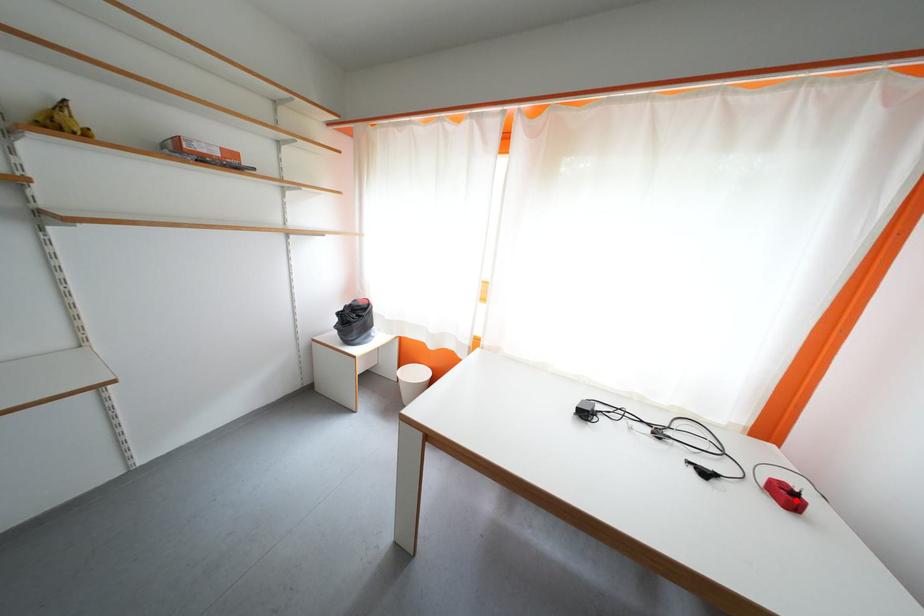
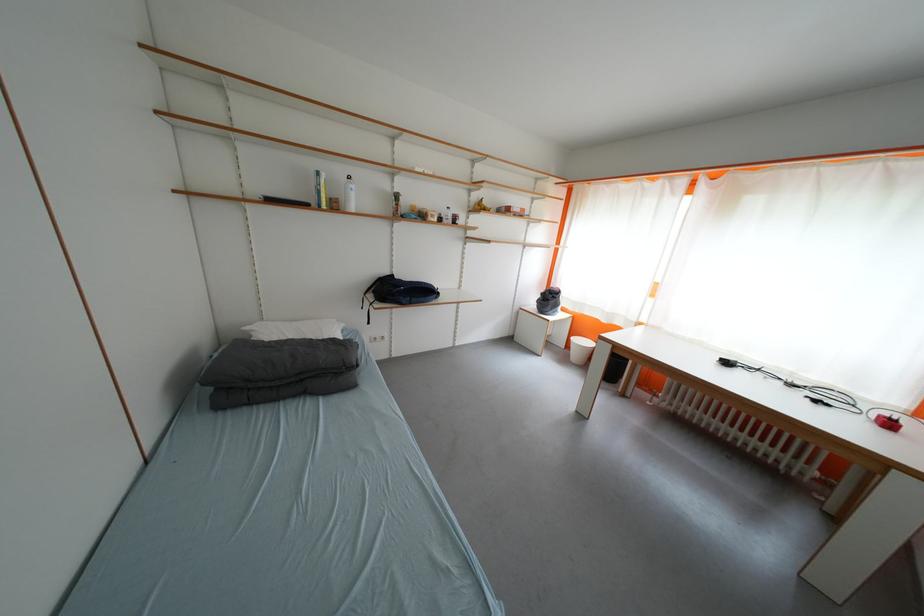
The point at the highlighted location is marked in the first image. Where is the corresponding point in the second image?

(897, 428)